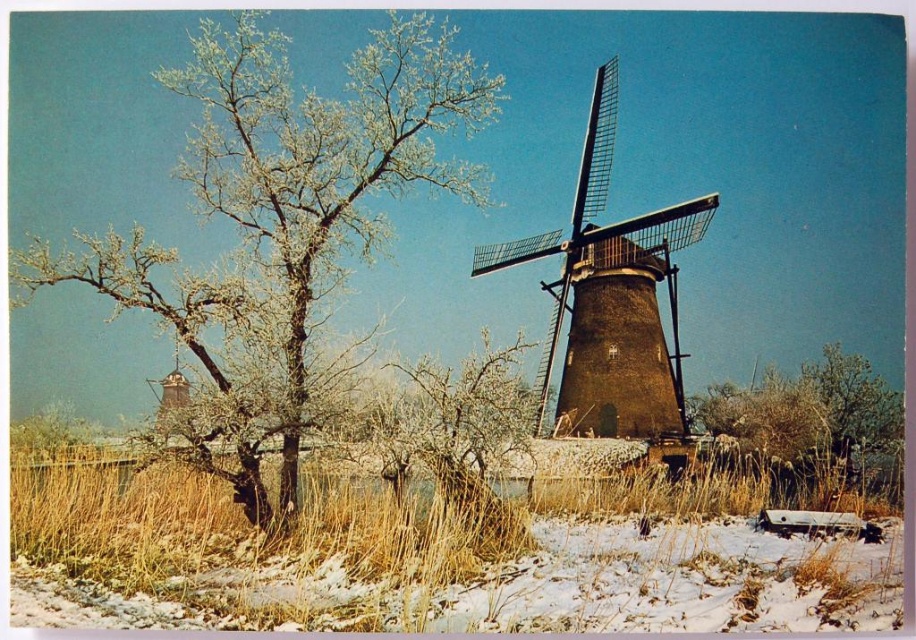
Is the position of white frosty branches at upper left less distant than that of brown textured bush at lower right?

Yes, white frosty branches at upper left is in front of brown textured bush at lower right.

Is point (417, 42) positioned after point (771, 417)?

No, it is not.

Who is more forward, (182,86) or (745,390)?

Positioned in front is point (182,86).

Identify the location of white frosty branches at upper left. (282, 216).

Does white frosty branches at upper left have a smaller size compared to brown textured windmill at center?

Actually, white frosty branches at upper left might be larger than brown textured windmill at center.

Image resolution: width=916 pixels, height=640 pixels. What do you see at coordinates (282, 216) in the screenshot?
I see `white frosty branches at upper left` at bounding box center [282, 216].

Where is `white frosty branches at upper left`? This screenshot has width=916, height=640. white frosty branches at upper left is located at coordinates (282, 216).

Can you confirm if brown textured windmill at center is positioned to the right of brown textured bush at lower right?

No, brown textured windmill at center is not to the right of brown textured bush at lower right.

Is point (597, 320) positioned in front of point (715, 403)?

Yes, point (597, 320) is in front of point (715, 403).

Locate an element on the screen. This screenshot has height=640, width=916. brown textured windmill at center is located at coordinates (611, 296).